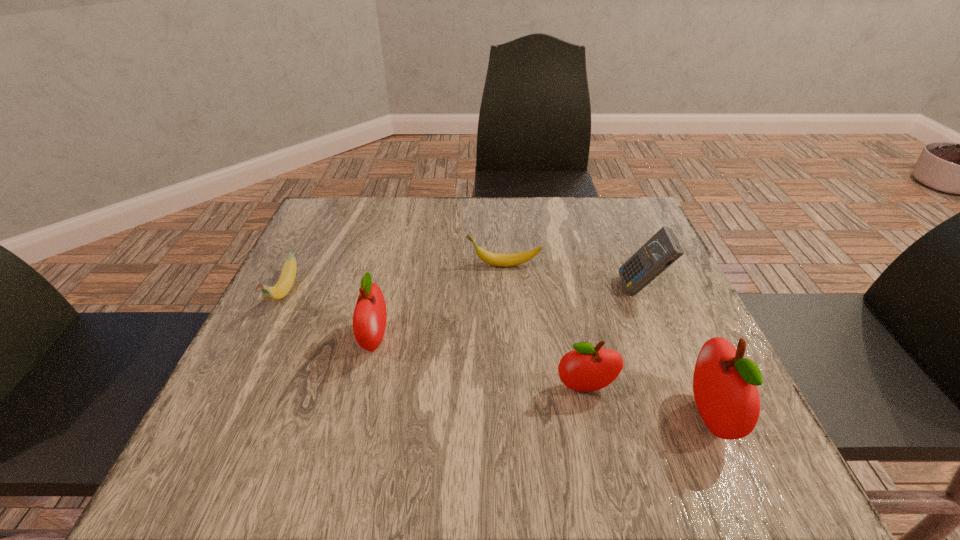
If equal spacing is desired by inserting an extra apple among them, please point out a free spot for this new apple. Please provide its 2D coordinates. Your answer should be formatted as a tuple, i.e. [(x, y)], where the tuple contains the x and y coordinates of a point satisfying the conditions above.

[(475, 363)]